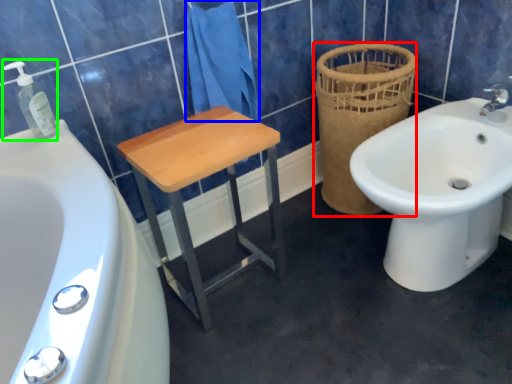
Question: Estimate the real-world distances between objects in this image. Which object is farther from basket (highlighted by a red box), bath towel (highlighted by a blue box) or soap dispenser (highlighted by a green box)?

Choices:
 (A) bath towel
 (B) soap dispenser

Answer: (B)